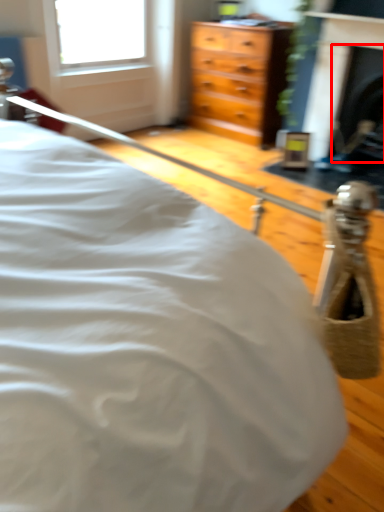
Question: From the image's perspective, what is the correct spatial relationship of fireplace (annotated by the red box) in relation to fireplace?

Choices:
 (A) above
 (B) below

Answer: (B)